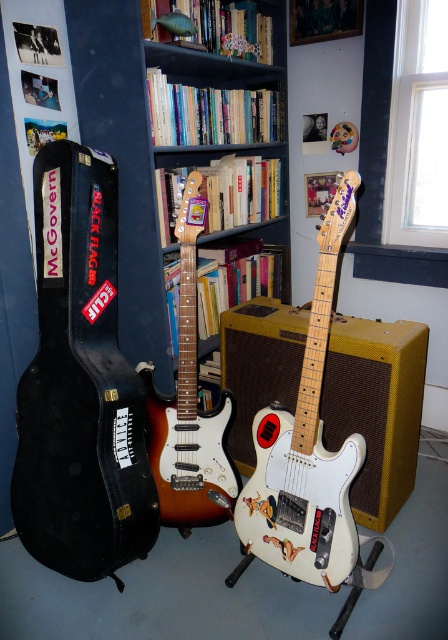
Question: Which of these objects is positioned farthest from the sunburst wood electric guitar at center?

Choices:
 (A) black matte guitar case at left
 (B) white glossy electric guitar at center

Answer: (B)

Question: Among these points, which one is farthest from the camera?

Choices:
 (A) (223, 458)
 (B) (51, 412)

Answer: (A)

Question: Is wooden bookcase at center smaller than sunburst wood electric guitar at center?

Choices:
 (A) no
 (B) yes

Answer: (A)

Question: Where is wooden bookcase at center located in relation to white glossy electric guitar at center in the image?

Choices:
 (A) left
 (B) right

Answer: (A)

Question: Can you confirm if wooden bookcase at center is wider than sunburst wood electric guitar at center?

Choices:
 (A) yes
 (B) no

Answer: (A)

Question: Considering the real-world distances, which object is farthest from the black matte guitar case at left?

Choices:
 (A) white glossy electric guitar at center
 (B) wooden bookcase at center
 (C) sunburst wood electric guitar at center

Answer: (A)